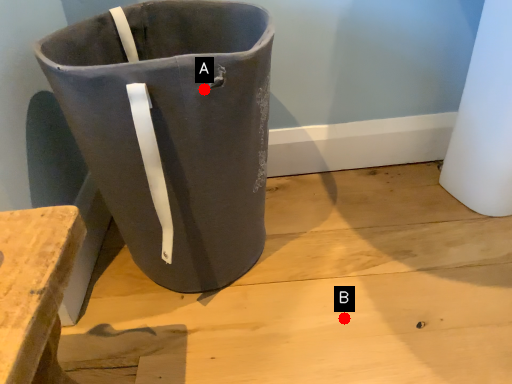
Question: Two points are circled on the image, labeled by A and B beside each circle. Which point is further to the camera?

Choices:
 (A) A is further
 (B) B is further

Answer: (B)